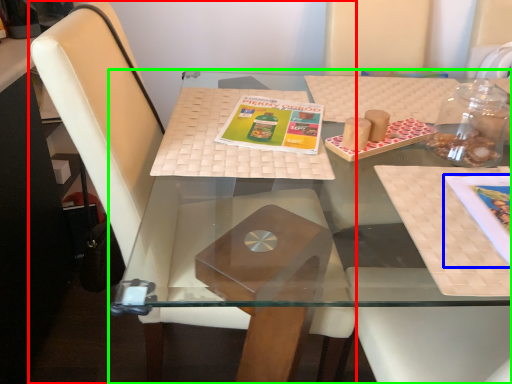
Question: Considering the real-world distances, which object is closest to chair (highlighted by a red box)? book cover (highlighted by a blue box) or table (highlighted by a green box).

Choices:
 (A) book cover
 (B) table

Answer: (B)